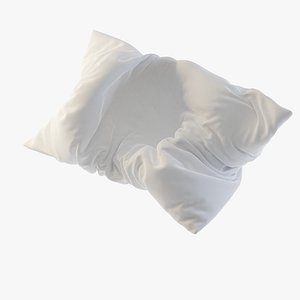
Locate an element on the screen. Image resolution: width=300 pixels, height=300 pixels. to the left of the pillow is located at coordinates (11, 131).